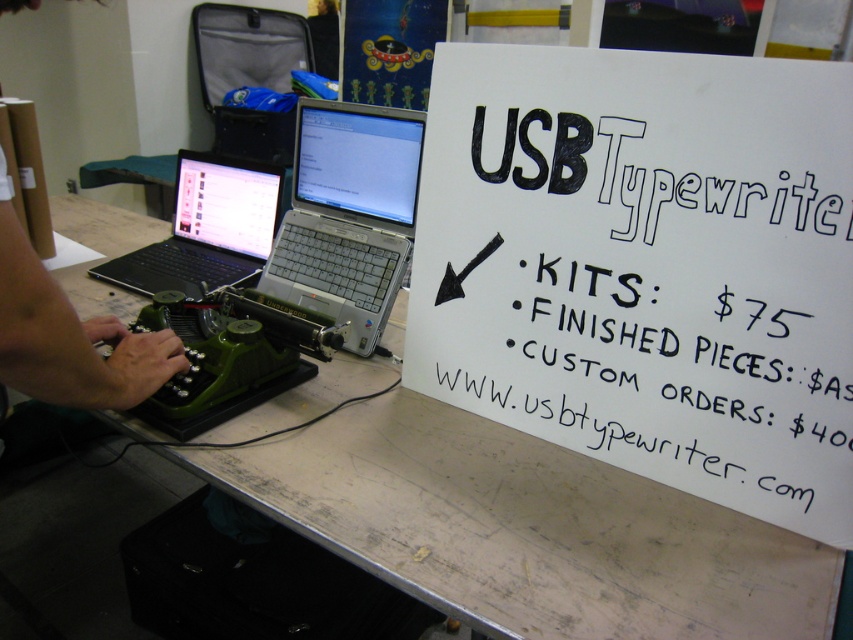
Is point (527, 248) more distant than point (351, 266)?

No.

Between white paper sign at upper right and silver metallic laptop at center, which one appears on the right side from the viewer's perspective?

white paper sign at upper right

The width and height of the screenshot is (853, 640). Find the location of `white paper sign at upper right`. white paper sign at upper right is located at coordinates (646, 266).

Who is more distant from viewer, (669,202) or (581,620)?

The point (669,202) is behind.

Can you confirm if white paper sign at upper right is smaller than green plastic typewriter at left?

Yes.

At what (x,y) coordinates should I click in order to perform the action: click on white paper sign at upper right. Please return your answer as a coordinate pair (x, y). Image resolution: width=853 pixels, height=640 pixels. Looking at the image, I should click on (646, 266).

Describe the element at coordinates (347, 216) in the screenshot. I see `silver metallic laptop at center` at that location.

Where is `silver metallic laptop at center`? The height and width of the screenshot is (640, 853). silver metallic laptop at center is located at coordinates (347, 216).

Find the location of `silver metallic laptop at center`. silver metallic laptop at center is located at coordinates (347, 216).